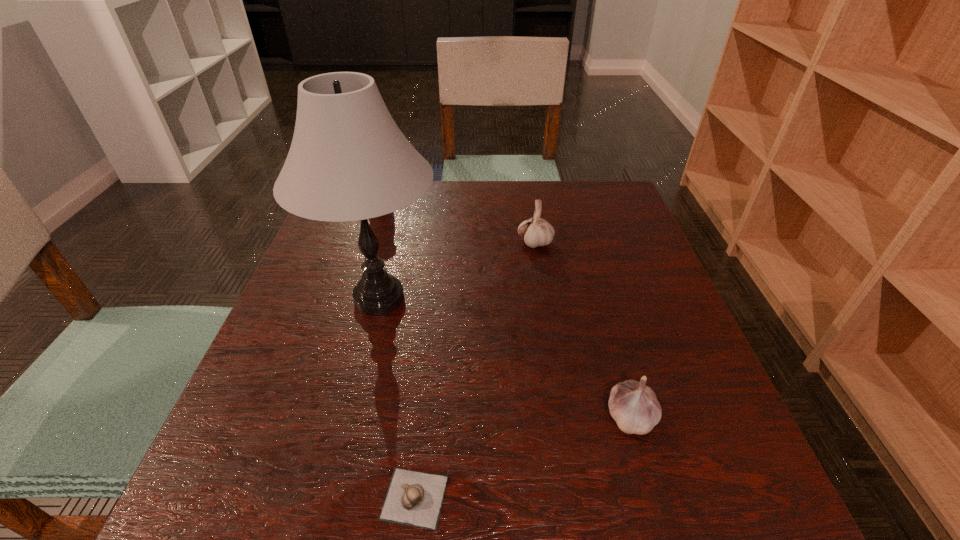
Identify the location of vacant space located on the back of the rightmost garlic. (589, 273).

This screenshot has height=540, width=960. Identify the location of free space located on the left of the shortest garlic. (228, 498).

Identify the location of object situated at the near edge. coord(414,498).

This screenshot has width=960, height=540. I want to click on object that is at the left edge, so click(x=348, y=161).

You are a GUI agent. You are given a task and a screenshot of the screen. Output one action in this format:
    pyautogui.click(x=<x>, y=<y>)
    Task: Click on the object situated at the right edge
    The image size is (960, 540).
    Given the screenshot: What is the action you would take?
    click(x=633, y=405)

Image resolution: width=960 pixels, height=540 pixels. I want to click on free region at the far edge, so click(463, 201).

Find the location of a particular element. free space at the near edge of the desktop is located at coordinates (500, 472).

This screenshot has width=960, height=540. Find the location of `vacant space at the right edge`. vacant space at the right edge is located at coordinates (661, 290).

Locate an element on the screen. Image resolution: width=960 pixels, height=540 pixels. free location at the far right corner of the desktop is located at coordinates (612, 204).

In the image, there is a desktop. Identify the location of vacant space at the near right corner. (728, 524).